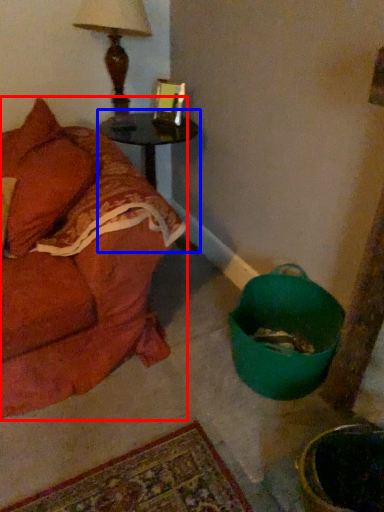
Question: Which object appears closest to the camera in this image, studio couch (highlighted by a red box) or table (highlighted by a blue box)?

Choices:
 (A) studio couch
 (B) table

Answer: (A)